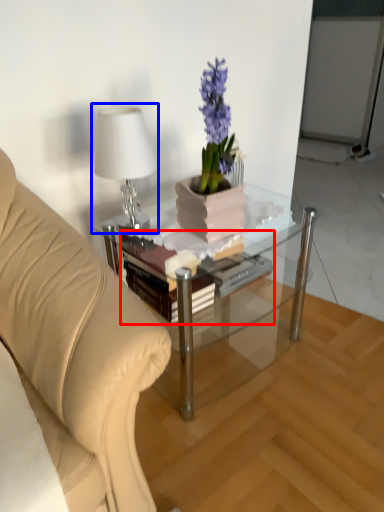
Question: Which point is further to the camera, book (highlighted by a red box) or table lamp (highlighted by a blue box)?

Choices:
 (A) book
 (B) table lamp

Answer: (A)